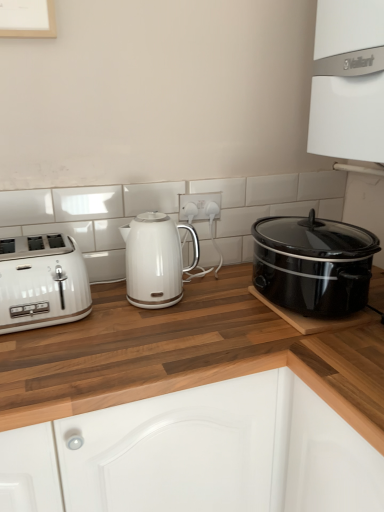
Question: From a real-world perspective, does white glossy vaillant boiler at upper right sit lower than white glossy toaster at left?

Choices:
 (A) no
 (B) yes

Answer: (A)

Question: From the image's perspective, is white glossy vaillant boiler at upper right below white glossy toaster at left?

Choices:
 (A) yes
 (B) no

Answer: (B)

Question: Does white glossy vaillant boiler at upper right lie in front of white glossy toaster at left?

Choices:
 (A) yes
 (B) no

Answer: (A)

Question: Is the position of white glossy vaillant boiler at upper right more distant than that of white glossy toaster at left?

Choices:
 (A) yes
 (B) no

Answer: (B)

Question: Could you tell me if white glossy vaillant boiler at upper right is turned towards white glossy toaster at left?

Choices:
 (A) yes
 (B) no

Answer: (A)

Question: Is white glossy vaillant boiler at upper right touching white glossy toaster at left?

Choices:
 (A) yes
 (B) no

Answer: (B)

Question: From the image's perspective, is black glossy slow cooker at right located beneath wooden at left?

Choices:
 (A) yes
 (B) no

Answer: (B)

Question: Can you confirm if black glossy slow cooker at right is wider than wooden at left?

Choices:
 (A) no
 (B) yes

Answer: (A)

Question: Is black glossy slow cooker at right oriented towards wooden at left?

Choices:
 (A) yes
 (B) no

Answer: (B)

Question: Does black glossy slow cooker at right appear on the left side of wooden at left?

Choices:
 (A) yes
 (B) no

Answer: (B)

Question: Is black glossy slow cooker at right to the right of wooden at left from the viewer's perspective?

Choices:
 (A) yes
 (B) no

Answer: (A)

Question: Is black glossy slow cooker at right outside wooden at left?

Choices:
 (A) yes
 (B) no

Answer: (A)

Question: Can you confirm if white glossy toaster at left is wider than white glossy kettle at center?

Choices:
 (A) yes
 (B) no

Answer: (A)